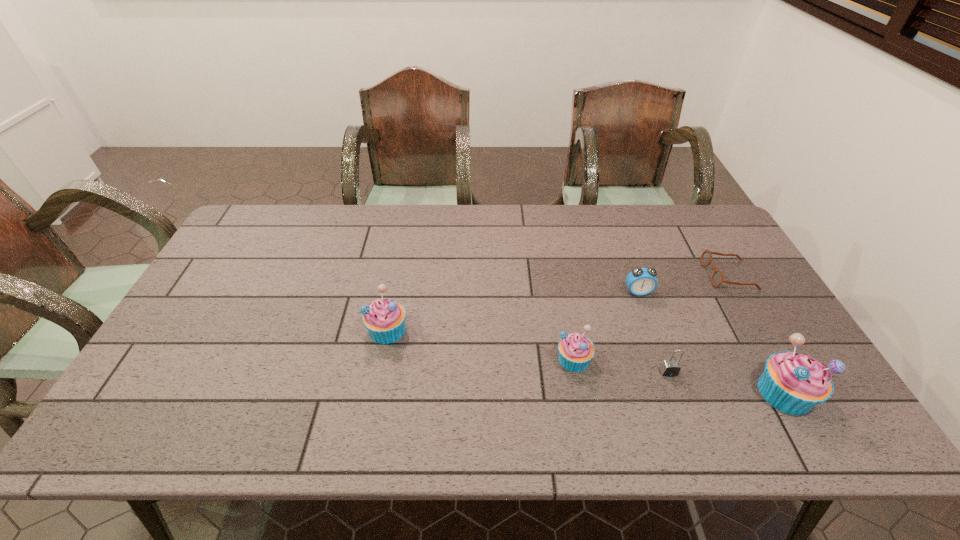
The image size is (960, 540). Identify the location of free space that satisfies the following two spatial constraints: 1. on the front-facing side of the spectacles; 2. on the face of the alarm clock. (739, 292).

This screenshot has width=960, height=540. What are the coordinates of `vacant region that satisfies the following two spatial constraints: 1. on the front-facing side of the shortest object; 2. on the face of the alarm clock` in the screenshot? It's located at (739, 292).